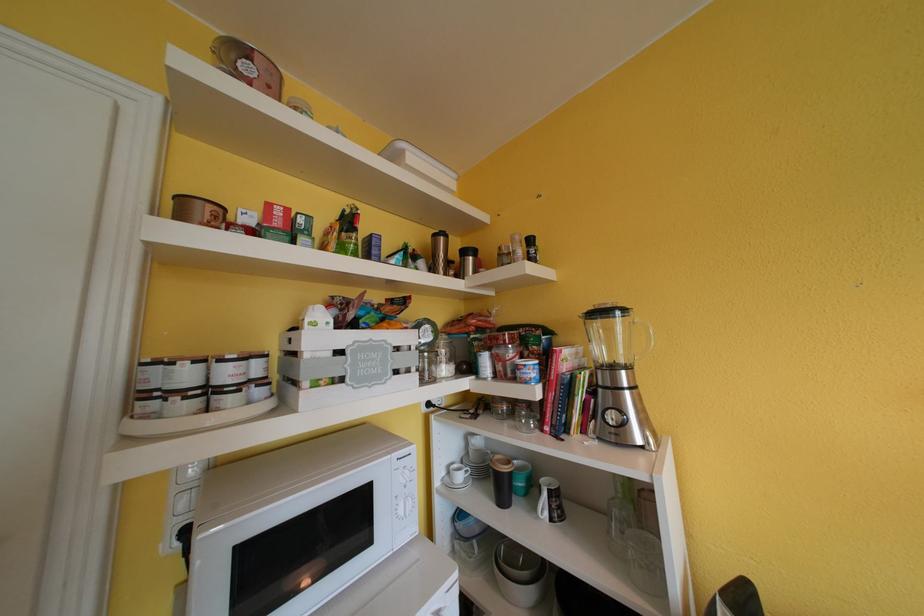
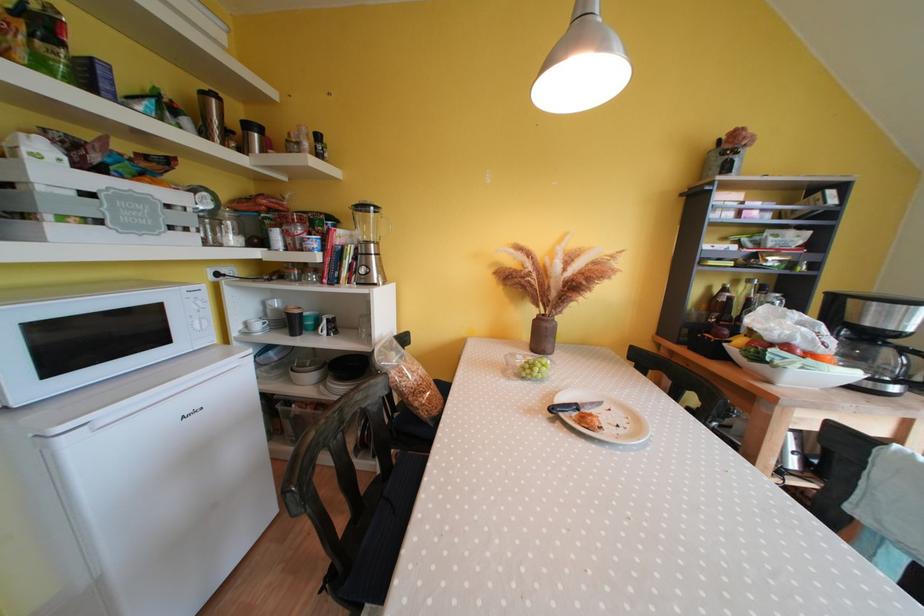
In the second image, find the point that corresponds to [629,375] in the first image.

(379, 249)